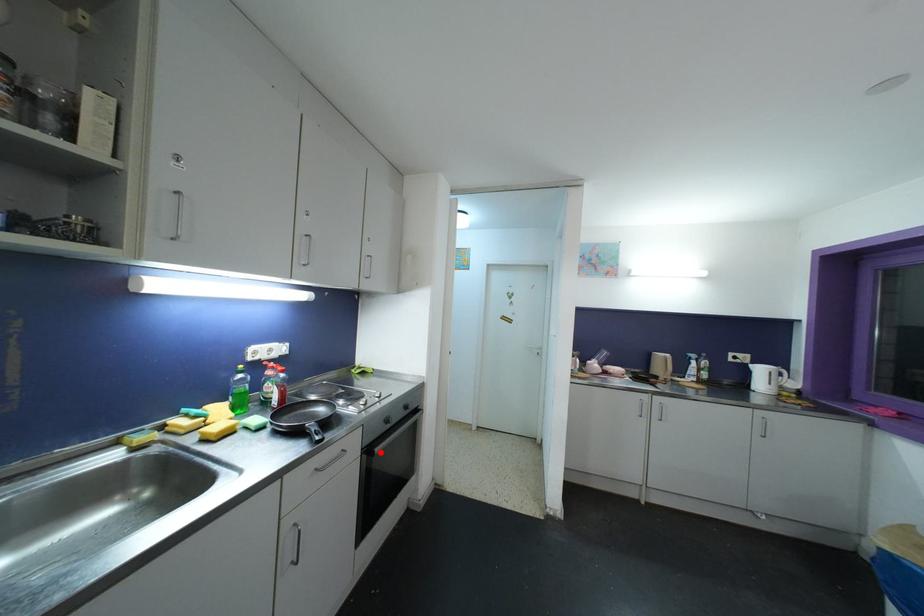
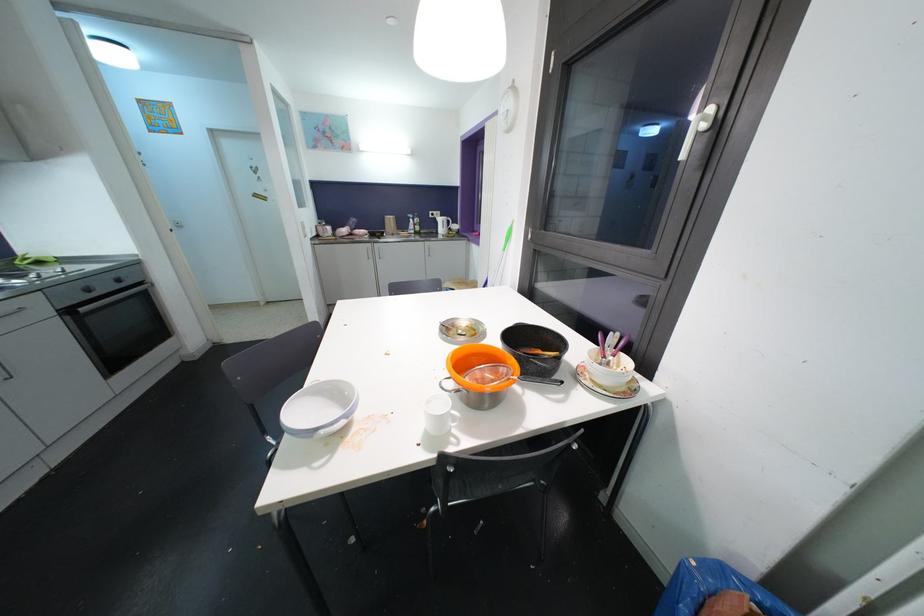
Locate, in the second image, the point that corresponds to the highlighted location in the first image.

(84, 312)